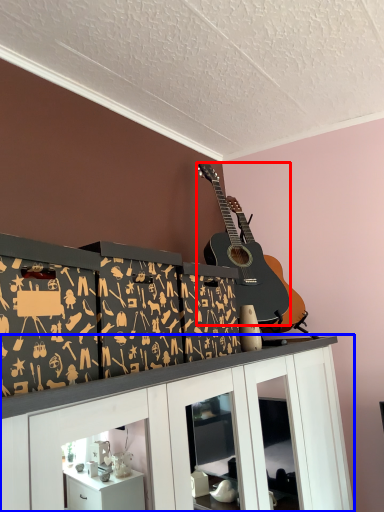
Question: Which of the following is the closest to the observer, guitar (highlighted by a red box) or cabinetry (highlighted by a blue box)?

Choices:
 (A) guitar
 (B) cabinetry

Answer: (B)